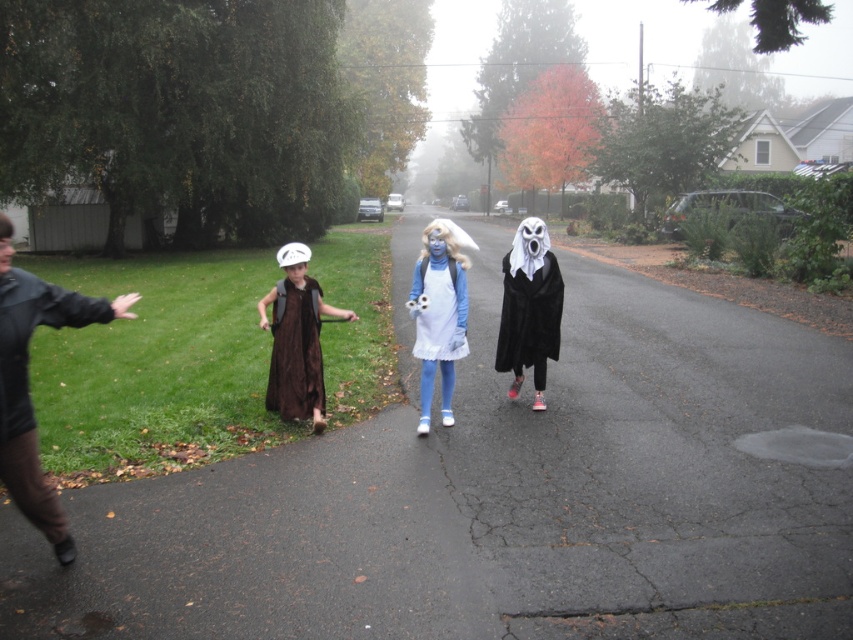
Question: In this image, where is dark brown leather jacket at left located relative to brown velvet vest at center?

Choices:
 (A) below
 (B) above

Answer: (B)

Question: Does dark brown leather jacket at left have a greater width compared to brown matte dress at center?

Choices:
 (A) no
 (B) yes

Answer: (A)

Question: Which of the following is the closest to the observer?

Choices:
 (A) brown matte dress at center
 (B) brown velvet vest at center
 (C) white matte ghost at center
 (D) dark brown leather jacket at left

Answer: (D)

Question: Among these objects, which one is farthest from the camera?

Choices:
 (A) brown matte dress at center
 (B) blue matte dress at center
 (C) brown velvet vest at center

Answer: (C)

Question: Is dark brown leather jacket at left smaller than white matte ghost at center?

Choices:
 (A) no
 (B) yes

Answer: (B)

Question: Which of the following is the closest to the observer?

Choices:
 (A) (297, 401)
 (B) (451, 296)
 (C) (289, 342)

Answer: (B)